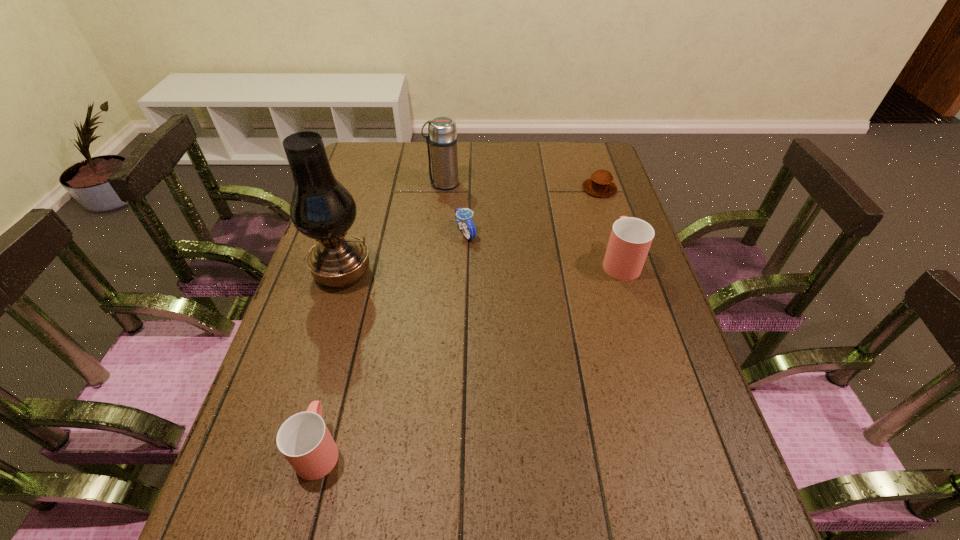
To ensure equal spacing by inserting another cup among them, please point out a vacant spot for this new cup. Please provide its 2D coordinates. Your answer should be formatted as a tuple, i.e. [(x, y)], where the tuple contains the x and y coordinates of a point satisfying the conditions above.

[(496, 338)]